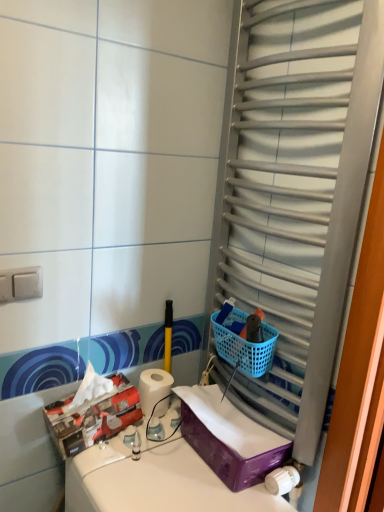
Question: From the image's perspective, is white plastic switch at upper left located above matte cardboard tissue box at lower left, which ranks as the second storage box in right-to-left order?

Choices:
 (A) no
 (B) yes

Answer: (B)

Question: Is white plastic switch at upper left looking in the opposite direction of matte cardboard tissue box at lower left, positioned as the 1th storage box in left-to-right order?

Choices:
 (A) no
 (B) yes

Answer: (A)

Question: Does white plastic switch at upper left have a greater height compared to matte cardboard tissue box at lower left, which ranks as the second storage box in right-to-left order?

Choices:
 (A) no
 (B) yes

Answer: (A)

Question: Is matte cardboard tissue box at lower left, positioned as the 1th storage box in left-to-right order, located within white plastic switch at upper left?

Choices:
 (A) no
 (B) yes

Answer: (A)

Question: Does white plastic switch at upper left have a smaller size compared to matte cardboard tissue box at lower left, positioned as the 1th storage box in left-to-right order?

Choices:
 (A) no
 (B) yes

Answer: (B)

Question: Is purple plastic storage box at lower right, placed as the second storage box when sorted from left to right, taller or shorter than white plastic switch at upper left?

Choices:
 (A) tall
 (B) short

Answer: (A)

Question: Considering the positions of purple plastic storage box at lower right, arranged as the first storage box when viewed from the right, and white plastic switch at upper left in the image, is purple plastic storage box at lower right, arranged as the first storage box when viewed from the right, wider or thinner than white plastic switch at upper left?

Choices:
 (A) thin
 (B) wide

Answer: (B)

Question: Considering the relative positions of purple plastic storage box at lower right, arranged as the first storage box when viewed from the right, and white plastic switch at upper left in the image provided, is purple plastic storage box at lower right, arranged as the first storage box when viewed from the right, to the left or to the right of white plastic switch at upper left?

Choices:
 (A) left
 (B) right

Answer: (B)

Question: Is purple plastic storage box at lower right, arranged as the first storage box when viewed from the right, in front of or behind white plastic switch at upper left in the image?

Choices:
 (A) behind
 (B) front

Answer: (A)

Question: From a real-world perspective, is white matte toilet paper at center physically located above or below matte cardboard tissue box at lower left, positioned as the 1th storage box in left-to-right order?

Choices:
 (A) below
 (B) above

Answer: (A)

Question: Considering the relative positions of white matte toilet paper at center and matte cardboard tissue box at lower left, positioned as the 1th storage box in left-to-right order, in the image provided, is white matte toilet paper at center to the left or to the right of matte cardboard tissue box at lower left, positioned as the 1th storage box in left-to-right order,?

Choices:
 (A) right
 (B) left

Answer: (A)

Question: Considering their positions, is white matte toilet paper at center located in front of or behind matte cardboard tissue box at lower left, positioned as the 1th storage box in left-to-right order?

Choices:
 (A) front
 (B) behind

Answer: (B)

Question: Would you say white matte toilet paper at center is inside or outside matte cardboard tissue box at lower left, which ranks as the second storage box in right-to-left order?

Choices:
 (A) outside
 (B) inside

Answer: (A)

Question: From a real-world perspective, is purple plastic storage box at lower right, arranged as the first storage box when viewed from the right, above or below blue plastic basket at right?

Choices:
 (A) below
 (B) above

Answer: (A)

Question: Considering the positions of purple plastic storage box at lower right, arranged as the first storage box when viewed from the right, and blue plastic basket at right in the image, is purple plastic storage box at lower right, arranged as the first storage box when viewed from the right, taller or shorter than blue plastic basket at right?

Choices:
 (A) short
 (B) tall

Answer: (B)